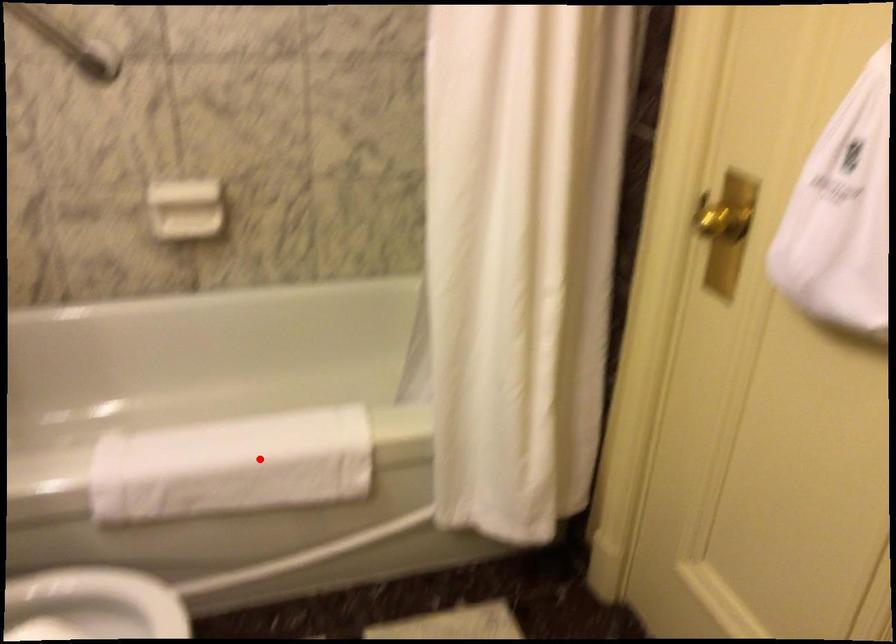
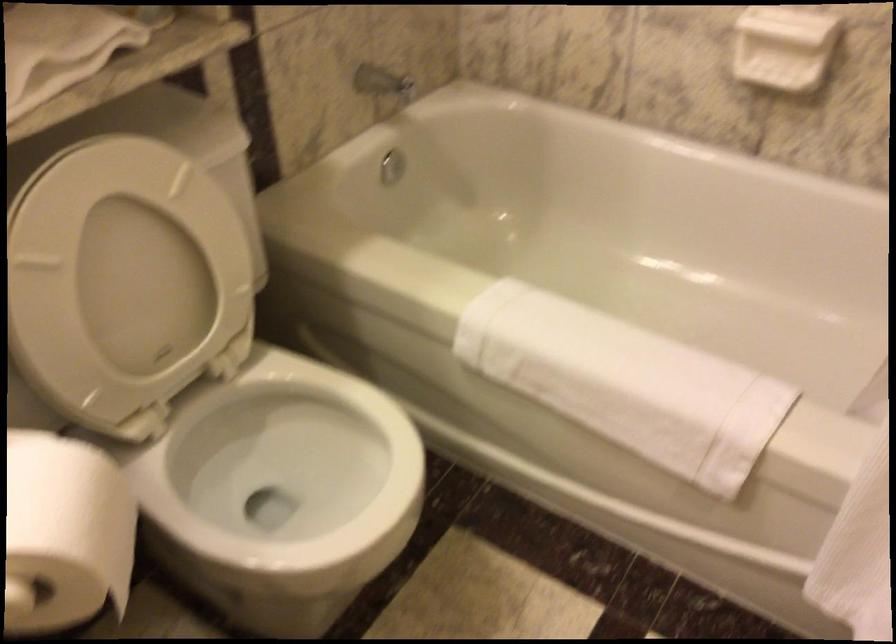
In the second image, find the point that corresponds to the highlighted location in the first image.

(625, 383)